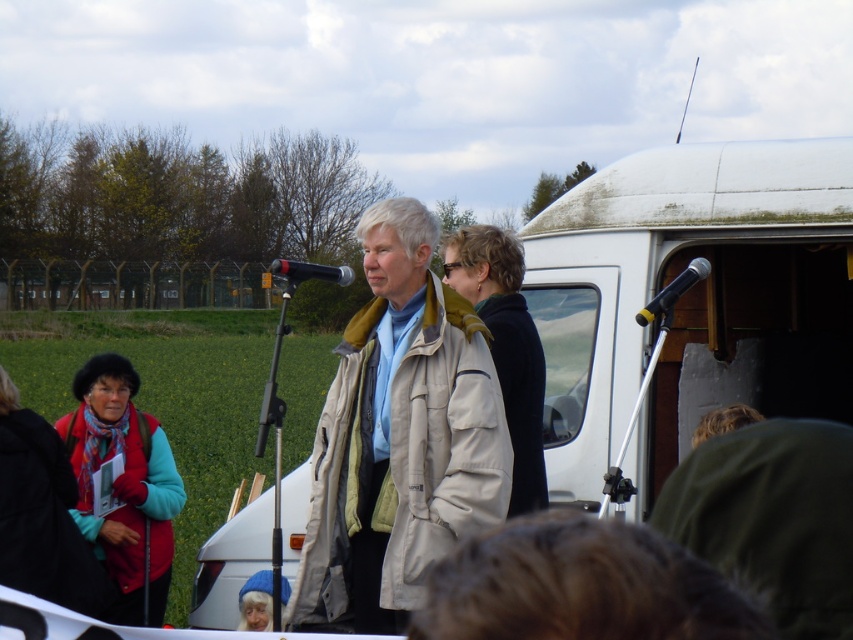
You are attending an outdoor event and notice the beige fabric coat at center and the metallic silver microphone at upper right. Based on their positions, which object is closer to the sky?

The beige fabric coat at center is above the metallic silver microphone at upper right, so the beige fabric coat at center is closer to the sky.

Based on the photo, you are standing at the origin point of the coordinate system. The metallic silver microphone at upper right is located at point (672, 292). If you want to move towards the microphone, which direction should you move?

The metallic silver microphone at upper right is located at point (672, 292), so you should move towards the upper right direction to reach it.

You are organizing a small event and need to decide whether to place a stand for the matte black microphone at center in front of the matte red vest at left. Based on their sizes, will the microphone block the view of the vest if placed directly in front?

The matte red vest at left is thinner than the matte black microphone at center, so placing the microphone directly in front would block the view of the vest since the microphone is wider.